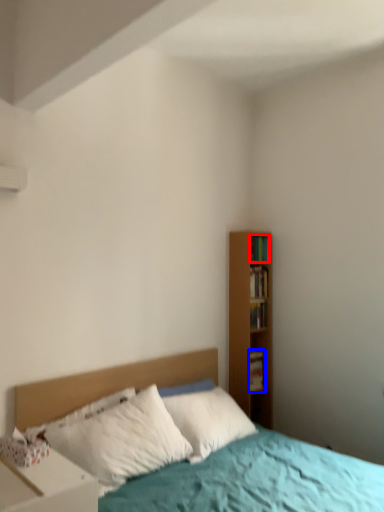
Question: Which point is further to the camera, book (highlighted by a red box) or book (highlighted by a blue box)?

Choices:
 (A) book
 (B) book

Answer: (B)